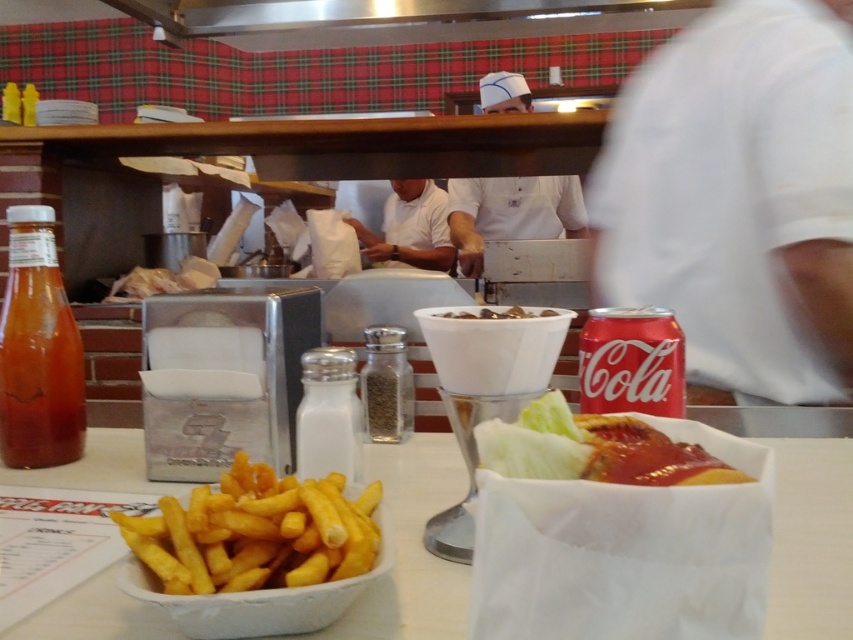
Looking at this image, who is positioned more to the left, translucent glass can at left or white chef hat at center?

translucent glass can at left is more to the left.

Does translucent glass can at left appear under white chef hat at center?

Yes, translucent glass can at left is below white chef hat at center.

Is point (13, 282) farther from viewer compared to point (480, 92)?

No, (13, 282) is closer to viewer.

Image resolution: width=853 pixels, height=640 pixels. Identify the location of translucent glass can at left. (38, 349).

Can you confirm if white paper bag at lower center is taller than brown matte bowl at center?

Correct, white paper bag at lower center is much taller as brown matte bowl at center.

I want to click on white paper bag at lower center, so click(x=410, y=547).

This screenshot has width=853, height=640. I want to click on white paper bag at lower center, so pos(410,547).

What do you see at coordinates (410, 227) in the screenshot? I see `white uniform at center` at bounding box center [410, 227].

Does white uniform at center come in front of brown matte bowl at center?

No, white uniform at center is behind brown matte bowl at center.

At what (x,y) coordinates should I click in order to perform the action: click on white uniform at center. Please return your answer as a coordinate pair (x, y). Image resolution: width=853 pixels, height=640 pixels. Looking at the image, I should click on (410, 227).

The image size is (853, 640). I want to click on white uniform at center, so click(410, 227).